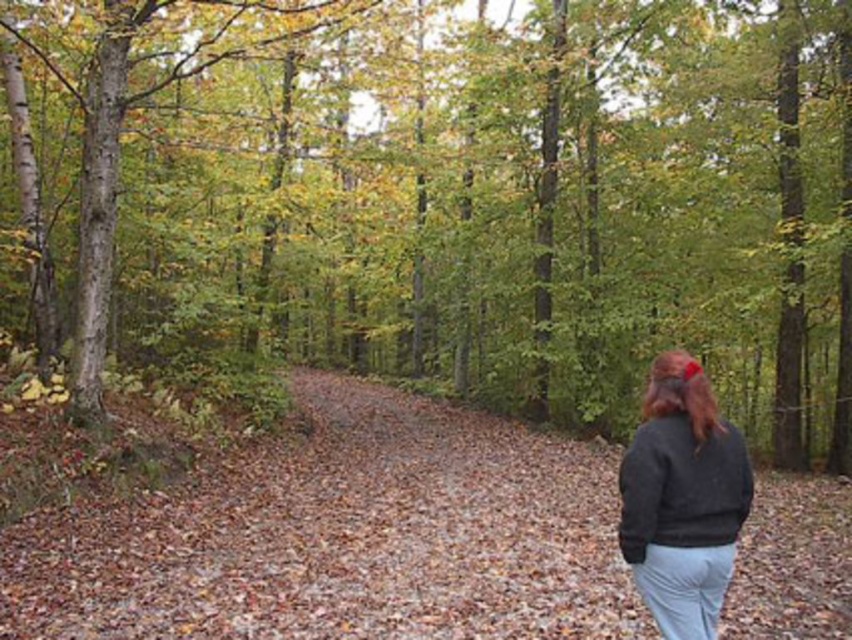
Question: Does brown matte tree at center appear on the left side of dark gray sweater at lower right?

Choices:
 (A) no
 (B) yes

Answer: (B)

Question: Observing the image, what is the correct spatial positioning of brown leafy forest path at center in reference to brown silky hair at upper right?

Choices:
 (A) left
 (B) right

Answer: (A)

Question: Does brown matte tree at center lie in front of brown silky hair at upper right?

Choices:
 (A) no
 (B) yes

Answer: (A)

Question: Which is nearer to the dark gray sweater at lower right?

Choices:
 (A) brown matte tree at center
 (B) brown leafy forest path at center

Answer: (B)

Question: Which object is closer to the camera taking this photo?

Choices:
 (A) brown leafy forest path at center
 (B) dark gray sweater at lower right
 (C) brown silky hair at upper right

Answer: (B)

Question: Which object is farther from the camera taking this photo?

Choices:
 (A) brown leafy forest path at center
 (B) brown matte tree at center
 (C) brown silky hair at upper right
 (D) dark gray sweater at lower right

Answer: (B)